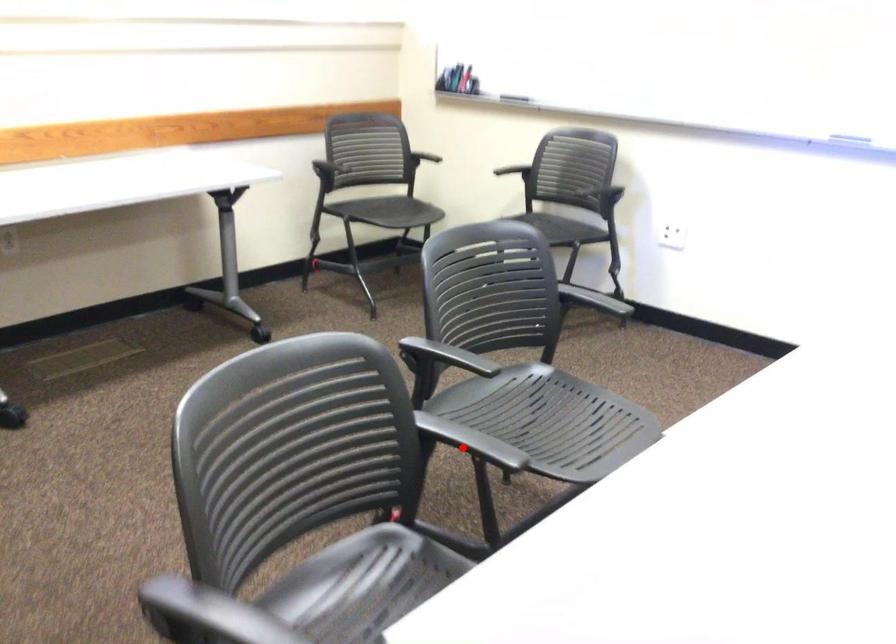
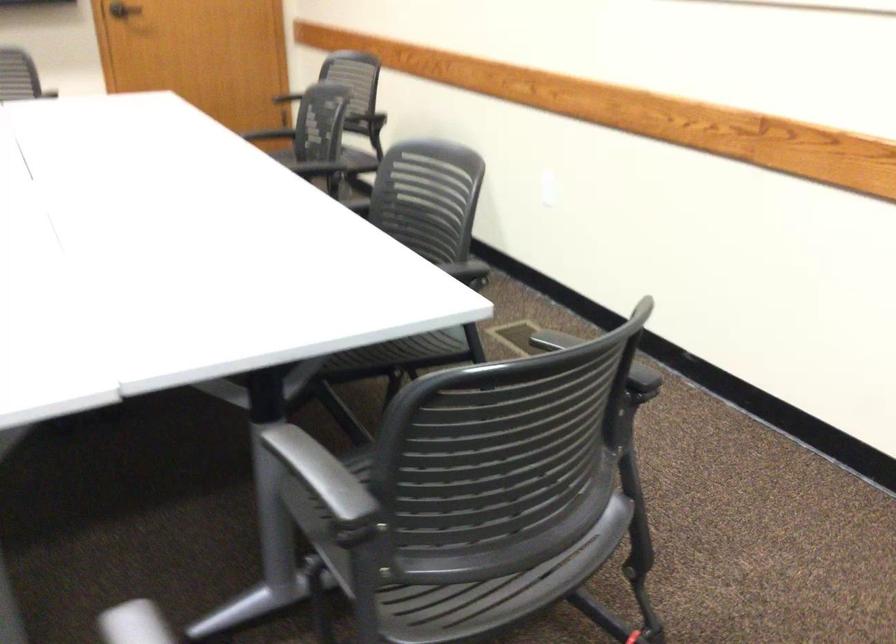
Locate, in the second image, the point that corresponds to the highlighted location in the first image.

(321, 473)